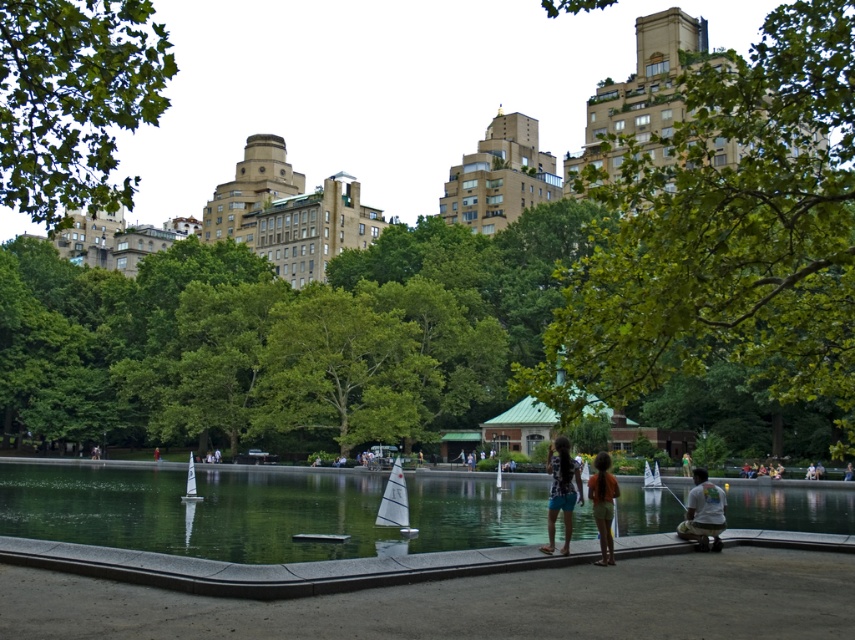
You are a drone operator who needs to fly a drone from your current position to the green leafy tree at center. The drone has a maximum flight range of 100 meters. Can you safely reach the tree without exceeding the drone range?

The distance between the green leafy tree at center and the camera is 97.63 meters, which is within the drone maximum flight range of 100 meters. Yes, you can safely reach the tree without exceeding the drone range.

You are standing in the park and want to take a photo of the green leafy tree at center and the matte black dress at center. Which object should you focus on first to ensure both are in the same frame?

You should focus on the green leafy tree at center first because it is closer to you than the matte black dress at center, allowing both to be captured in the same frame.

You are standing in the park and want to take a photo of the green leafy tree at upper center without the white cotton shirt at lower right blocking the view. Which direction should you move to ensure the tree is fully visible?

Move away from the white cotton shirt at lower right so that the green leafy tree at upper center, which is closer to you, can be framed without obstruction from the shirt.